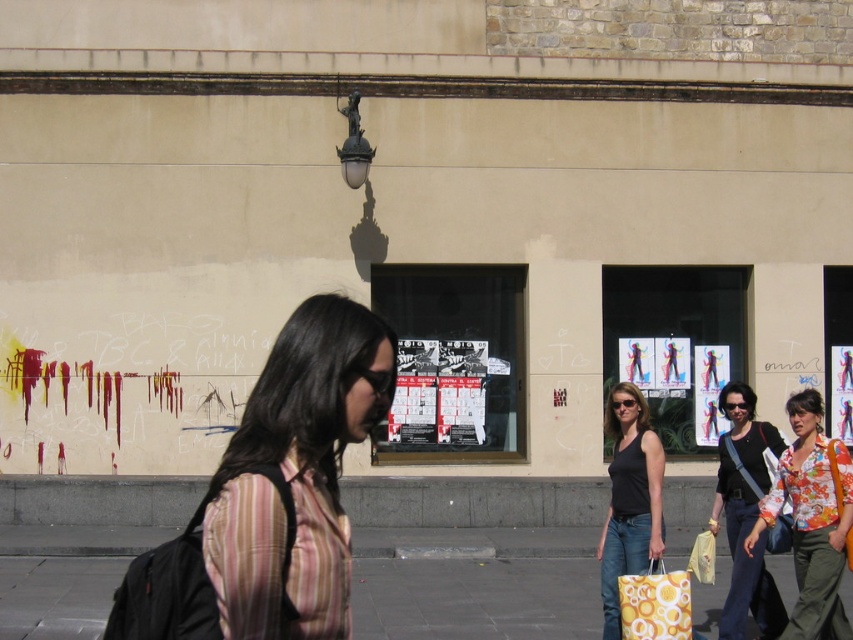
Who is more distant from viewer, (728, 525) or (627, 440)?

Positioned behind is point (728, 525).

Which of these two, matte black tank top at center right or black matte tank top at center, stands shorter?

Standing shorter between the two is black matte tank top at center.

Measure the distance between matte black tank top at center right and camera.

matte black tank top at center right and camera are 8.24 meters apart from each other.

Where is `matte black tank top at center right`? matte black tank top at center right is located at coordinates (746, 515).

Is smooth concrete pavement at lower center above yellow printed fabric shopping bag at lower right?

Actually, smooth concrete pavement at lower center is below yellow printed fabric shopping bag at lower right.

Identify the location of smooth concrete pavement at lower center. Image resolution: width=853 pixels, height=640 pixels. (474, 598).

At what (x,y) coordinates should I click in order to perform the action: click on smooth concrete pavement at lower center. Please return your answer as a coordinate pair (x, y). The image size is (853, 640). Looking at the image, I should click on (474, 598).

Who is more forward, [828,499] or [714,352]?

Positioned in front is point [828,499].

Looking at this image, which of these two, floral print shirt at center or colorful paper poster at center, stands taller?

With more height is floral print shirt at center.

What do you see at coordinates (811, 518) in the screenshot? The height and width of the screenshot is (640, 853). I see `floral print shirt at center` at bounding box center [811, 518].

Locate an element on the screen. floral print shirt at center is located at coordinates (811, 518).